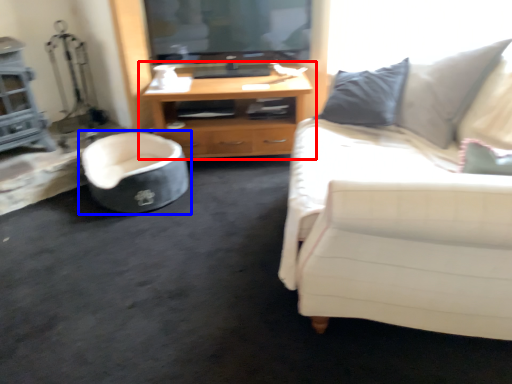
Question: Which object is further to the camera taking this photo, cabinetry (highlighted by a red box) or chair (highlighted by a blue box)?

Choices:
 (A) cabinetry
 (B) chair

Answer: (A)